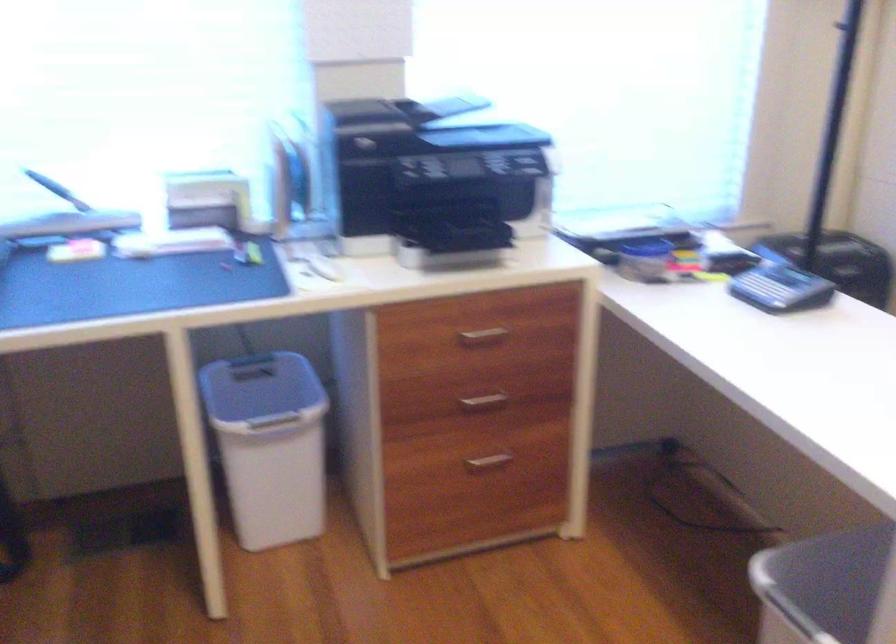
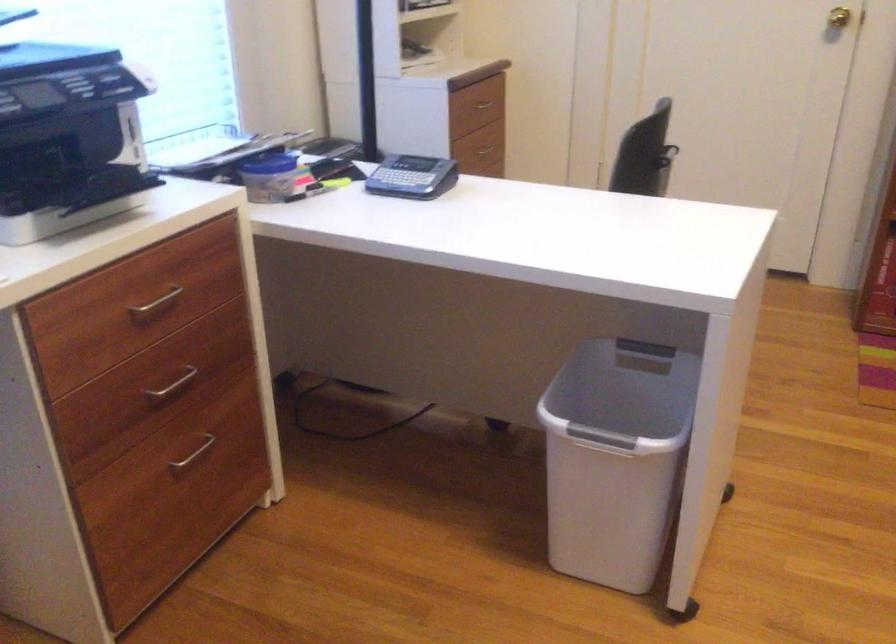
The point at (492, 460) is marked in the first image. Where is the corresponding point in the second image?

(193, 453)